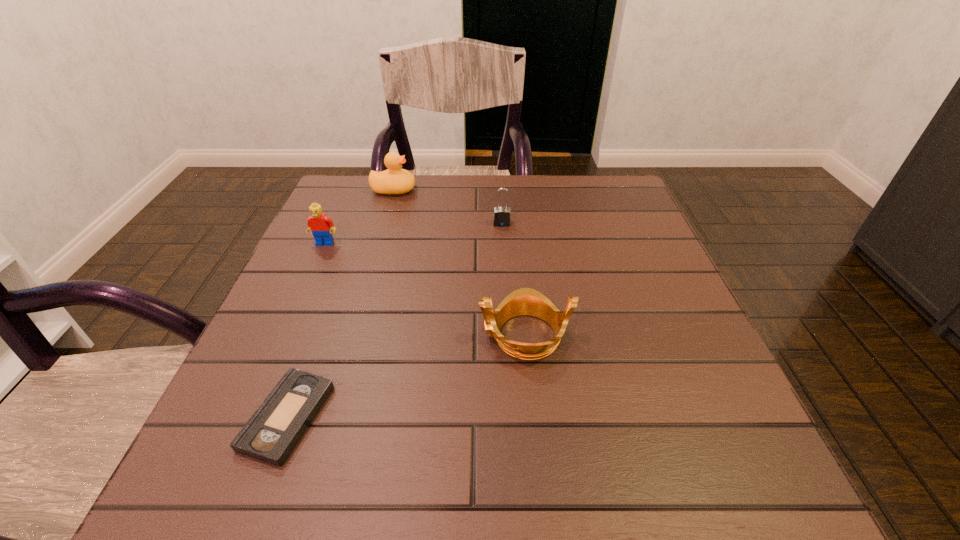
Where is `duck`? This screenshot has height=540, width=960. duck is located at coordinates (394, 180).

The image size is (960, 540). I want to click on the third nearest object, so click(321, 226).

Locate an element on the screen. The height and width of the screenshot is (540, 960). the fourth nearest object is located at coordinates (501, 217).

Locate an element on the screen. Image resolution: width=960 pixels, height=540 pixels. tiara is located at coordinates (525, 301).

Where is `the shortest object`? The height and width of the screenshot is (540, 960). the shortest object is located at coordinates (270, 435).

At what (x,y) coordinates should I click in order to perform the action: click on the nearest object. Please return your answer as a coordinate pair (x, y). The image size is (960, 540). Looking at the image, I should click on (270, 435).

This screenshot has width=960, height=540. What are the coordinates of `vacant space located 0.330m on the face of the duck` in the screenshot? It's located at (538, 190).

Identify the location of vacant space located on the face of the third nearest object. The height and width of the screenshot is (540, 960). (303, 291).

Locate an element on the screen. free region located 0.200m on the shackle of the padlock is located at coordinates (506, 282).

The width and height of the screenshot is (960, 540). In order to click on vacant space situated at the front emblem of the second nearest object in this screenshot , I will do `click(379, 335)`.